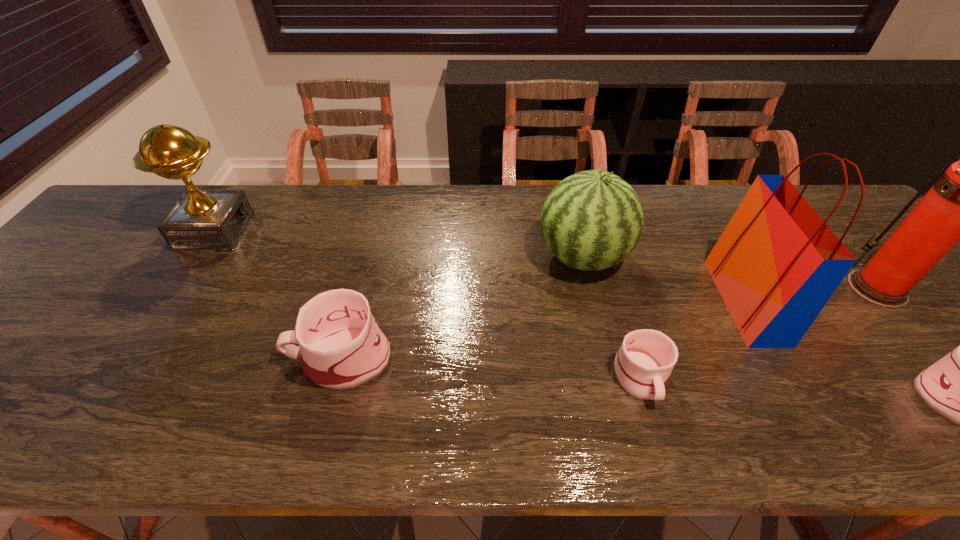
Given the evenly spaced mugs in the image, where should an extra mug be added on the left to preserve the spacing? Please point to a vacant space. Please provide its 2D coordinates. Your answer should be formatted as a tuple, i.e. [(x, y)], where the tuple contains the x and y coordinates of a point satisfying the conditions above.

[(60, 339)]